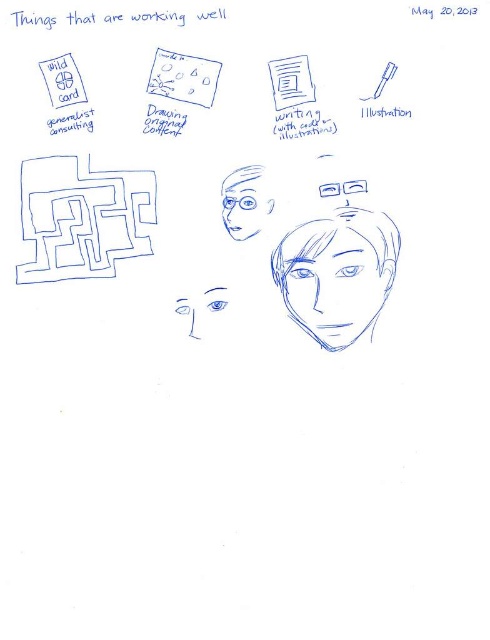
Can you confirm if blue line art maze at upper left is smaller than blue matte glasses at center?

Incorrect, blue line art maze at upper left is not smaller in size than blue matte glasses at center.

Does blue line art maze at upper left appear over blue matte glasses at center?

Actually, blue line art maze at upper left is below blue matte glasses at center.

Who is more distant from viewer, (102, 246) or (271, 204)?

The point (271, 204) is behind.

Locate an element on the screen. blue line art maze at upper left is located at coordinates (82, 218).

Which is more to the left, blue line art maze at upper left or smooth skin face at center?

From the viewer's perspective, blue line art maze at upper left appears more on the left side.

Between blue line art maze at upper left and smooth skin face at center, which one is positioned higher?

blue line art maze at upper left

Image resolution: width=490 pixels, height=640 pixels. In order to click on blue line art maze at upper left in this screenshot , I will do `click(82, 218)`.

Based on the photo, can you confirm if smooth skin face at center is wider than blue sketchy face at center?

Yes.

Is point (300, 301) closer to viewer compared to point (222, 296)?

Yes, point (300, 301) is closer to viewer.

Is point (287, 307) closer to camera compared to point (220, 308)?

Yes, it is.

I want to click on smooth skin face at center, so click(x=334, y=284).